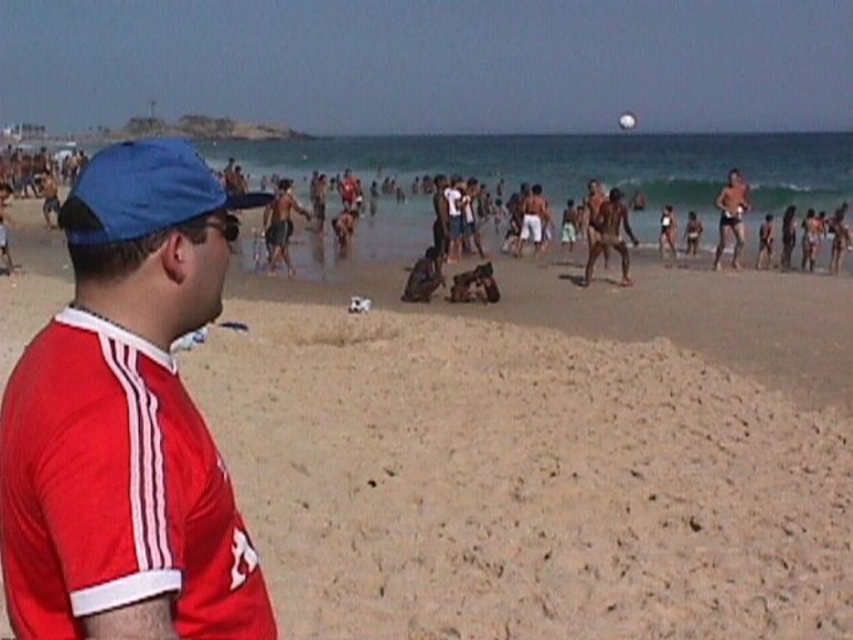
You are standing at the point with coordinates point (x=200, y=164) and want to walk to the point with coordinates point (x=381, y=394). Given the beach scene described, will you have to walk towards the beach or away from it?

Point (x=381, y=394) is behind point (x=200, y=164), so you will have to walk away from the beach towards the point (x=381, y=394).

You are standing on the beige sandy beach at center and want to pick up the blue fabric baseball cap at left. Can you easily reach it without moving from your current position?

The blue fabric baseball cap at left is behind the beige sandy beach at center, so you cannot easily reach it without moving from your current position.

You are a photographer trying to capture a photo of the beach scene. You notice the red matte jersey at left and the smooth tan skin at right. Which object should you focus on first if you want to ensure both are in focus, considering their positions?

The red matte jersey at left should be focused on first because it is positioned under the smooth tan skin at right, meaning it is closer to the camera. By focusing on the closer object, the depth of field may allow the background object to also be in focus.